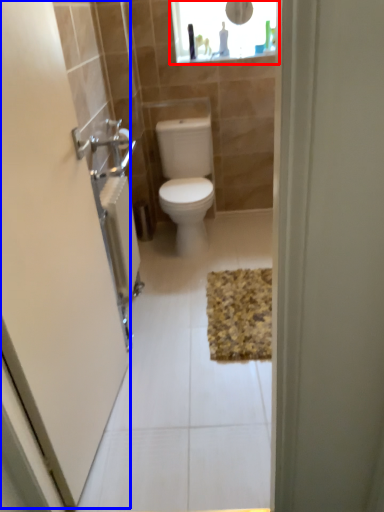
Question: Which object is closer to the camera taking this photo, medicine cabinet (highlighted by a red box) or screen door (highlighted by a blue box)?

Choices:
 (A) medicine cabinet
 (B) screen door

Answer: (B)